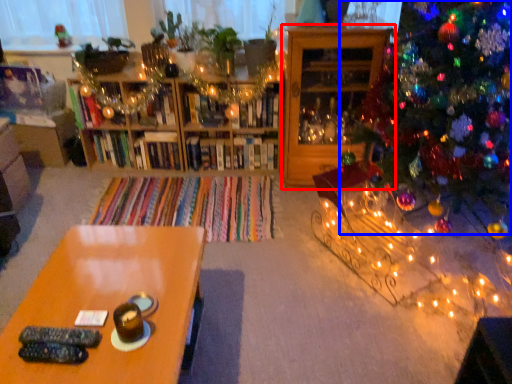
Question: Among these objects, which one is nearest to the camera, shelf (highlighted by a red box) or christmas tree (highlighted by a blue box)?

Choices:
 (A) shelf
 (B) christmas tree

Answer: (B)